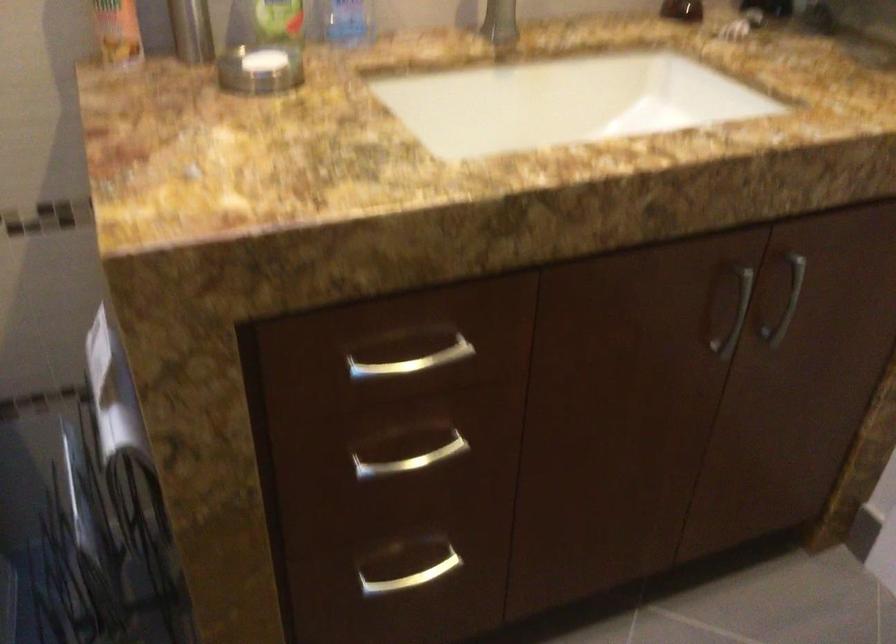
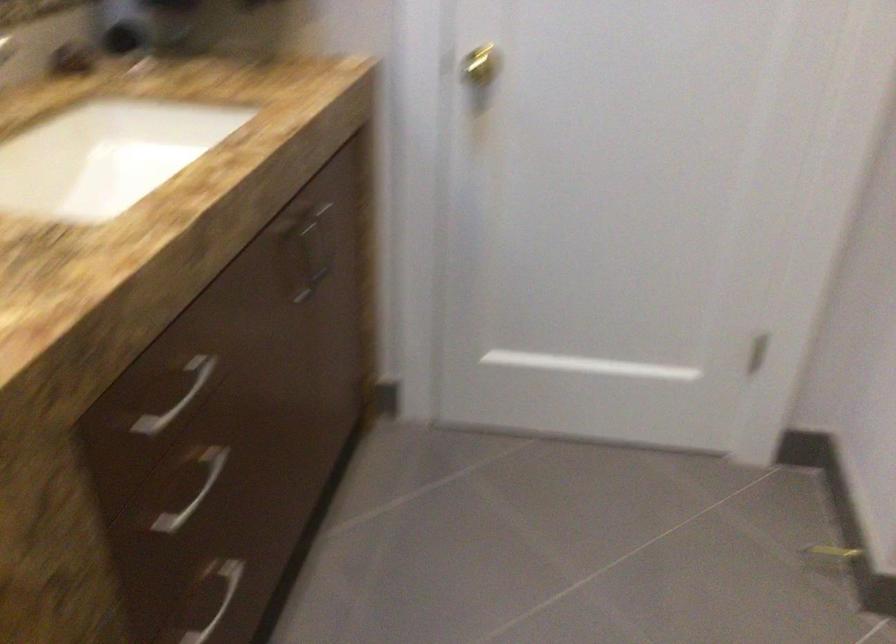
Question: The first image is from the beginning of the video and the second image is from the end. How did the camera likely rotate when shooting the video?

Choices:
 (A) Left
 (B) Right
 (C) Up
 (D) Down

Answer: (B)